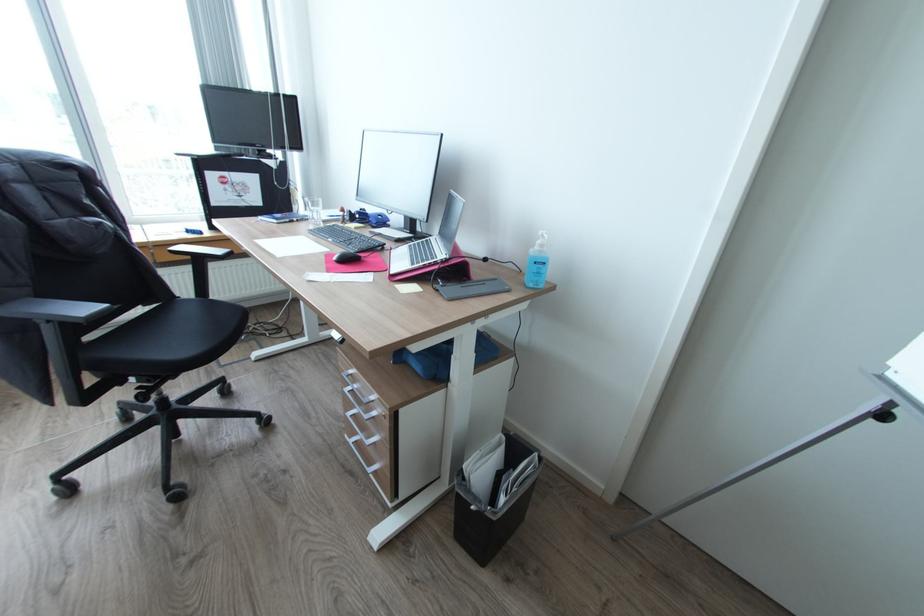
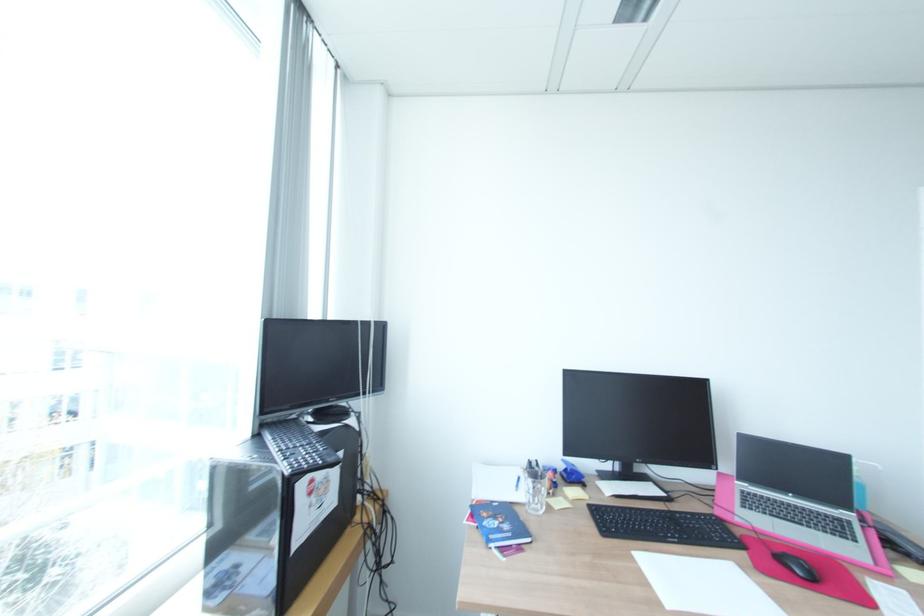
Locate, in the second image, the point that corresponds to (335,238) in the first image.

(681, 541)